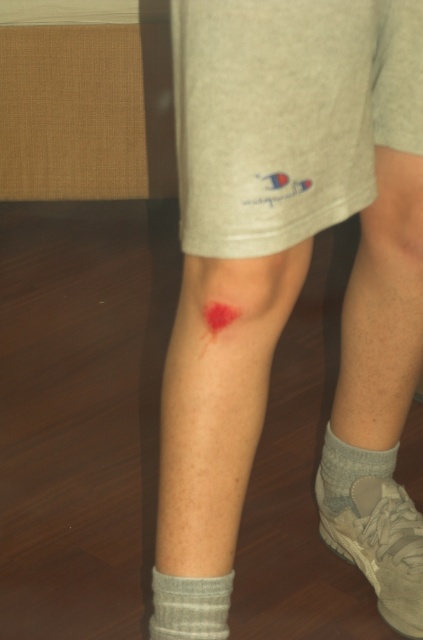
Question: Which object is the farthest from the scarred skin at lower center?

Choices:
 (A) gray ribbed sock at lower left
 (B) suede shoe at lower right
 (C) gray cotton sock at lower right
 (D) bright red scar at lower center

Answer: (A)

Question: Is bright red scar at lower center thinner than gray cotton sock at lower right?

Choices:
 (A) no
 (B) yes

Answer: (A)

Question: Which of the following is the closest to the observer?

Choices:
 (A) (342, 458)
 (B) (387, 518)
 (C) (206, 564)

Answer: (C)

Question: Is gray ribbed sock at lower left closer to camera compared to gray cotton sock at lower right?

Choices:
 (A) no
 (B) yes

Answer: (B)

Question: Based on their relative distances, which object is farther from the bright red scar at lower center?

Choices:
 (A) gray ribbed sock at lower left
 (B) gray cotton sock at lower right
 (C) scarred skin at lower center
 (D) suede shoe at lower right

Answer: (D)

Question: Does gray ribbed sock at lower left appear under gray cotton sock at lower right?

Choices:
 (A) yes
 (B) no

Answer: (A)